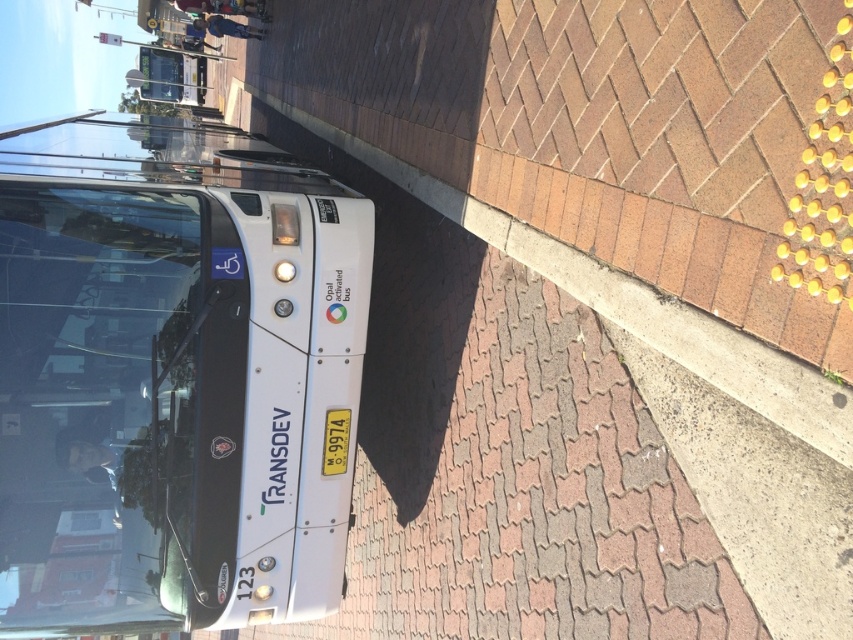
Question: Which point appears closest to the camera in this image?

Choices:
 (A) (222, 627)
 (B) (668, 320)

Answer: (B)

Question: Is white matte bus at left smaller than concrete at lower right?

Choices:
 (A) yes
 (B) no

Answer: (B)

Question: Which object appears closest to the camera in this image?

Choices:
 (A) concrete at lower right
 (B) white matte bus at left

Answer: (A)

Question: Does white matte bus at left lie behind concrete at lower right?

Choices:
 (A) no
 (B) yes

Answer: (B)

Question: Does white matte bus at left appear under concrete at lower right?

Choices:
 (A) no
 (B) yes

Answer: (A)